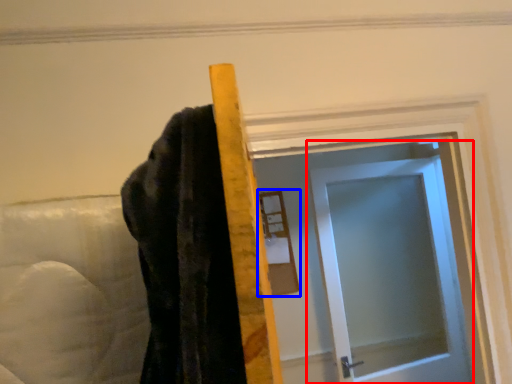
Question: Which object appears farthest to the camera in this image, door (highlighted by a red box) or mirror (highlighted by a blue box)?

Choices:
 (A) door
 (B) mirror

Answer: (B)